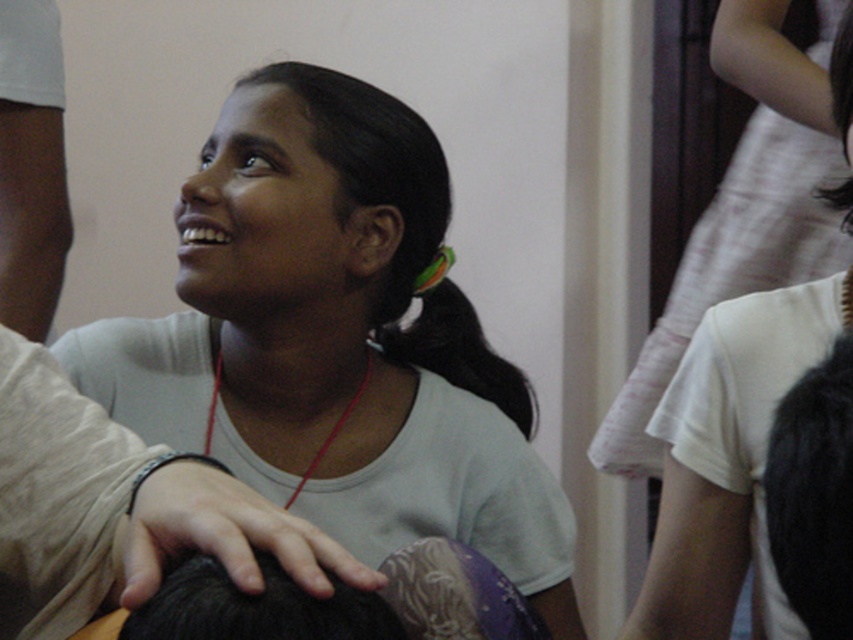
You are taking a photo and want to focus on the two points in the image, point (x=338, y=134) and point (x=26, y=56). Which point is closer to your camera lens?

Point (x=338, y=134) is closer to the camera lens than point (x=26, y=56).